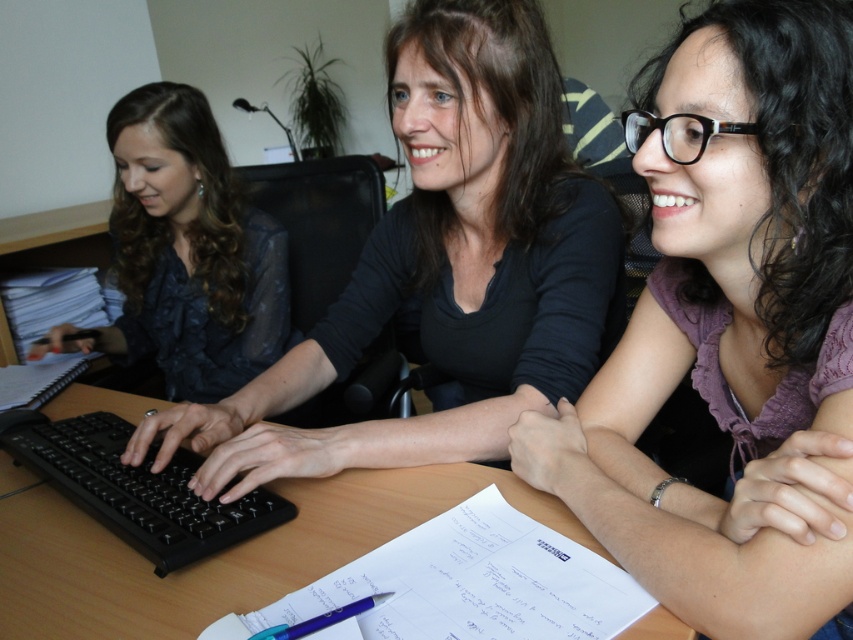
Question: From the image, what is the correct spatial relationship of matte black shirt at center in relation to black plastic keyboard at center?

Choices:
 (A) below
 (B) above

Answer: (B)

Question: Does purple fabric shirt at center have a smaller size compared to blue plastic pen at lower center?

Choices:
 (A) no
 (B) yes

Answer: (A)

Question: Which point appears farthest from the camera in this image?

Choices:
 (A) tap(637, 580)
 (B) tap(335, 621)
 (C) tap(167, 596)

Answer: (C)

Question: Which point appears closest to the camera in this image?

Choices:
 (A) (360, 602)
 (B) (764, 104)
 (C) (79, 419)

Answer: (A)

Question: Considering the relative positions of purple fabric shirt at center and matte black shirt at center in the image provided, where is purple fabric shirt at center located with respect to matte black shirt at center?

Choices:
 (A) above
 (B) below

Answer: (B)

Question: Estimate the real-world distances between objects in this image. Which object is farther from the purple fabric shirt at center?

Choices:
 (A) wooden table at center
 (B) matte black blouse at left
 (C) black plastic keyboard at center
 (D) matte black shirt at center

Answer: (B)